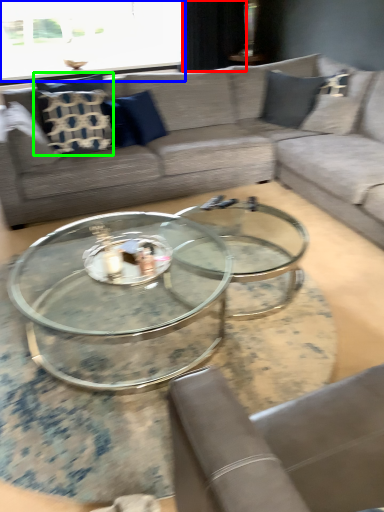
Question: Which is nearer to the curtain (highlighted by a red box)? window screen (highlighted by a blue box) or pillow (highlighted by a green box).

Choices:
 (A) window screen
 (B) pillow

Answer: (A)